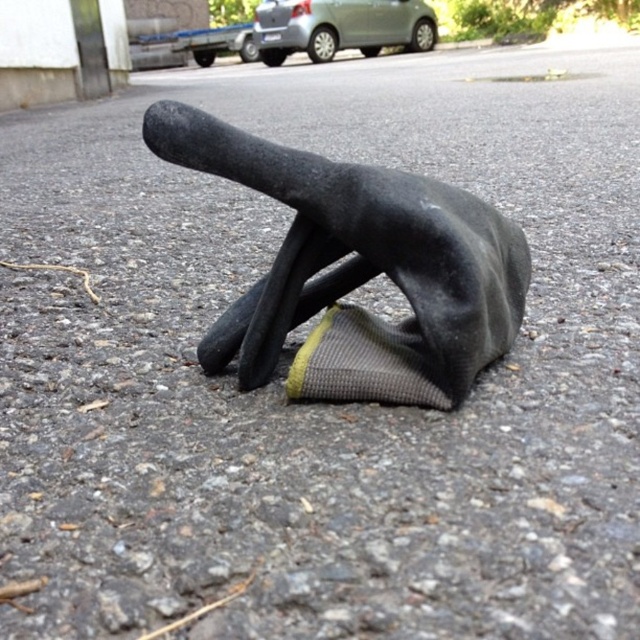
How far apart are black rubber glove at center and satin silver car at upper center?

They are 8.91 meters apart.

Can you confirm if black rubber glove at center is wider than satin silver car at upper center?

No, black rubber glove at center is not wider than satin silver car at upper center.

What do you see at coordinates (358, 269) in the screenshot?
I see `black rubber glove at center` at bounding box center [358, 269].

You are a GUI agent. You are given a task and a screenshot of the screen. Output one action in this format:
    pyautogui.click(x=<x>, y=<y>)
    Task: Click on the black rubber glove at center
    The image size is (640, 640).
    Given the screenshot: What is the action you would take?
    pyautogui.click(x=358, y=269)